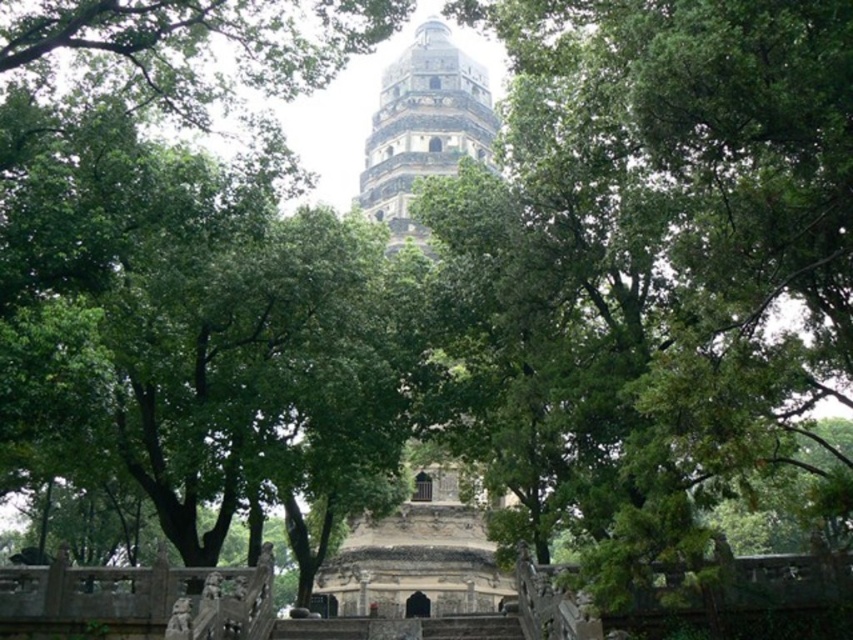
You are a tourist visiting the historic site and want to take a photo of the gray stone tower at center. However, you notice the dark gray stone stairs at center might block your view. Based on the scene description, can you determine if the stairs will block the tower in your photo?

The gray stone tower at center is bigger than the dark gray stone stairs at center, so the tower is larger in size. However, since both are at the center, the stairs could still block the view of the tower depending on their positioning. The description does not provide information about their depth or exact spatial arrangement, so it is uncertain if the stairs will block the tower in the photo.

You are a visitor approaching the stone tower at center and dark gray stone stairs at center in the historic setting. Which object is closer to you as you enter the scene?

The stone tower at center is closer to you than the dark gray stone stairs at center, so the stone tower at center is closer.